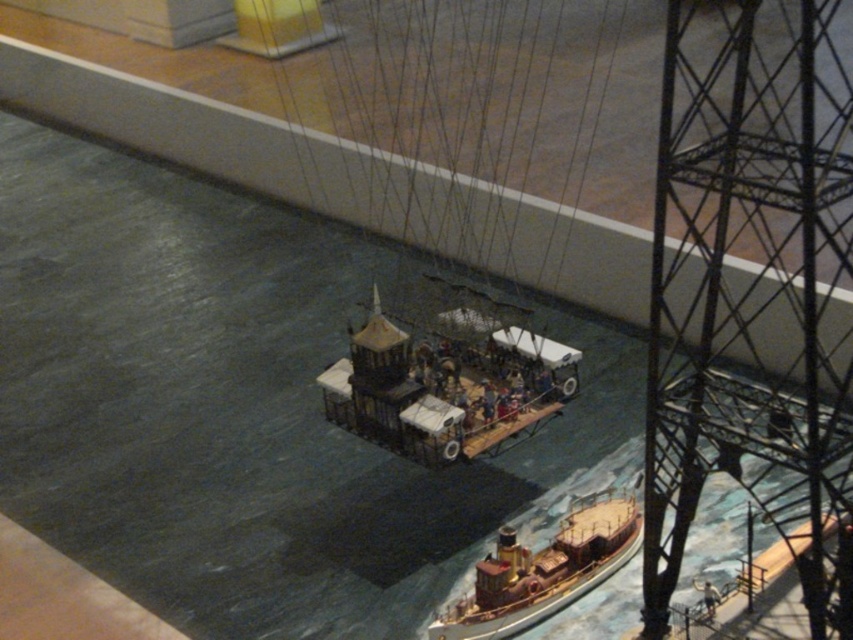
Is point (372, 346) farther from viewer compared to point (476, 577)?

Yes, it is behind point (476, 577).

Is point (566, 348) closer to viewer compared to point (503, 609)?

That is False.

Find the location of a particular element. Image resolution: width=853 pixels, height=640 pixels. wooden ship at center is located at coordinates (445, 385).